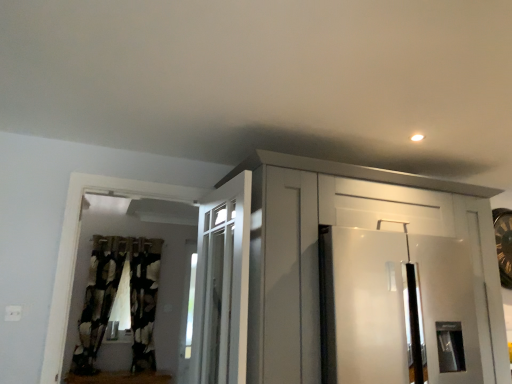
Question: Considering the positions of black textured curtain at left, the 2th curtain positioned from the left, and white glossy cabinet at upper center in the image, is black textured curtain at left, the 2th curtain positioned from the left, wider or thinner than white glossy cabinet at upper center?

Choices:
 (A) wide
 (B) thin

Answer: (B)

Question: From their relative heights in the image, would you say black textured curtain at left, arranged as the 1th curtain when viewed from the right, is taller or shorter than white glossy cabinet at upper center?

Choices:
 (A) tall
 (B) short

Answer: (A)

Question: Which of these objects is positioned closest to the black textured curtain at left, the 2th curtain positioned from the left?

Choices:
 (A) white glossy refrigerator at right
 (B) white glossy cabinet at upper center
 (C) black textured curtain at left, the 2th curtain positioned from the right

Answer: (C)

Question: Considering the real-world distances, which object is farthest from the black textured curtain at left, arranged as the 1th curtain when viewed from the right?

Choices:
 (A) black textured curtain at left, the 2th curtain positioned from the right
 (B) white glossy cabinet at upper center
 (C) white glossy refrigerator at right

Answer: (C)